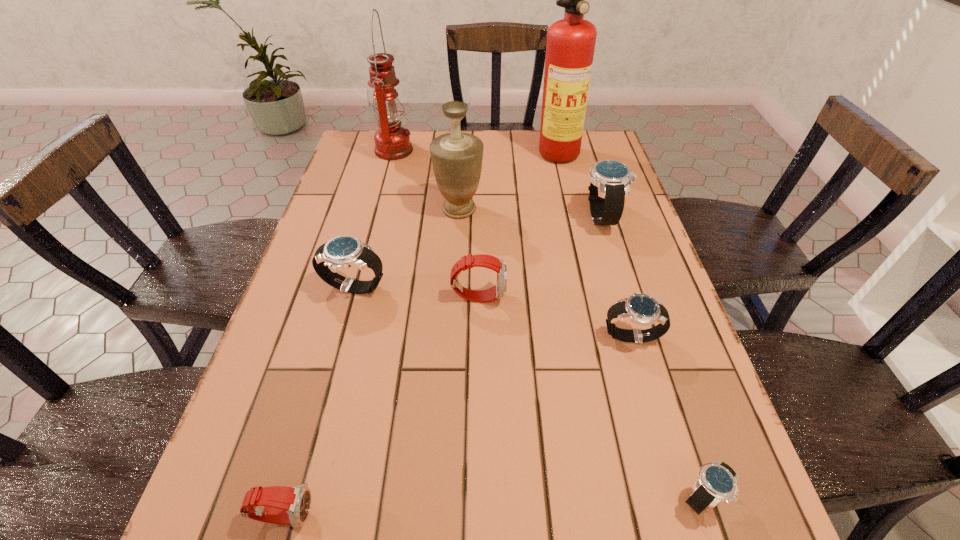
Where is `vacant space located 0.260m on the left of the farthest silver watch`? This screenshot has height=540, width=960. vacant space located 0.260m on the left of the farthest silver watch is located at coordinates (485, 217).

Identify the location of free point located 0.310m on the front of the leftmost silver watch. 313,441.

This screenshot has width=960, height=540. In order to click on vacant region located on the face of the bigger red watch in this screenshot , I will do `click(549, 296)`.

In order to click on vacant area located 0.310m on the front of the third nearest watch in this screenshot , I will do `click(684, 519)`.

Locate an element on the screen. The width and height of the screenshot is (960, 540). vacant space located on the face of the nearer red watch is located at coordinates (423, 514).

Where is `free location located 0.110m on the back of the smallest silver watch`? free location located 0.110m on the back of the smallest silver watch is located at coordinates (674, 412).

This screenshot has height=540, width=960. What are the coordinates of `fire extinguisher that is at the far edge` in the screenshot? It's located at (570, 46).

I want to click on oil lamp present at the far edge, so click(392, 141).

The width and height of the screenshot is (960, 540). I want to click on object that is at the near edge, so click(284, 505).

Locate an element on the screen. The image size is (960, 540). oil lamp that is at the left edge is located at coordinates (392, 141).